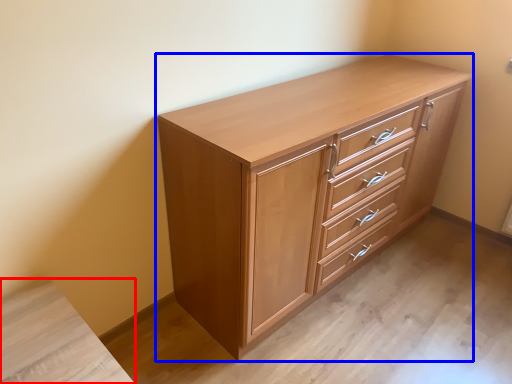
Question: Which point is closer to the camera, vanity (highlighted by a red box) or chest of drawers (highlighted by a blue box)?

Choices:
 (A) vanity
 (B) chest of drawers

Answer: (A)